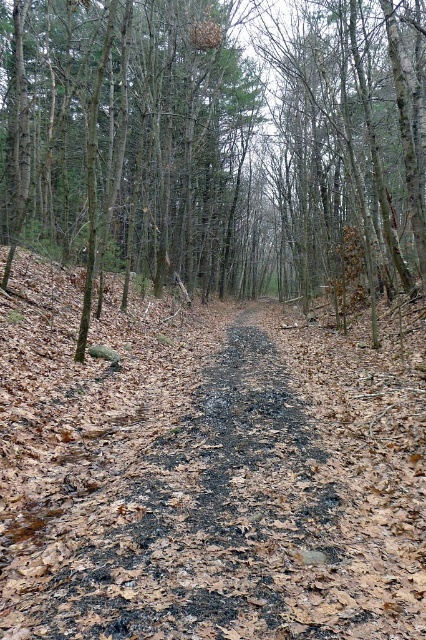
Which is more to the left, brown bark tree at center or charcoal ash path at center?

brown bark tree at center

Which is above, brown bark tree at center or charcoal ash path at center?

brown bark tree at center is above.

Is point (101, 113) closer to camera compared to point (362, 632)?

No, (101, 113) is behind (362, 632).

The image size is (426, 640). What are the coordinates of `brown bark tree at center` in the screenshot? It's located at (215, 144).